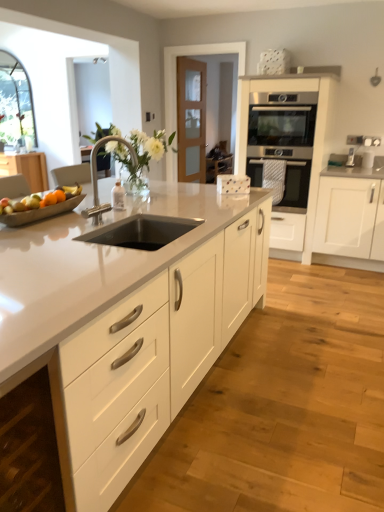
Question: From the image's perspective, is white matte cabinet at lower left, the first cabinetry positioned from the left, over satin white oven at center, which is the 3th cabinetry in front-to-back order?

Choices:
 (A) yes
 (B) no

Answer: (B)

Question: Is white matte cabinet at lower left, which is the 3th cabinetry in right-to-left order, behind satin white oven at center, which is the 3th cabinetry in front-to-back order?

Choices:
 (A) no
 (B) yes

Answer: (A)

Question: From a real-world perspective, is white matte cabinet at lower left, which is the 3th cabinetry in right-to-left order, beneath satin white oven at center, marked as the 2th cabinetry in a right-to-left arrangement?

Choices:
 (A) yes
 (B) no

Answer: (A)

Question: Is white matte cabinet at lower left, the first cabinetry positioned from the left, thinner than satin white oven at center, positioned as the 2th cabinetry in left-to-right order?

Choices:
 (A) no
 (B) yes

Answer: (B)

Question: Are white matte cabinet at lower left, the first cabinetry positioned from the left, and satin white oven at center, which is the 3th cabinetry in front-to-back order, located far from each other?

Choices:
 (A) yes
 (B) no

Answer: (A)

Question: From the image's perspective, is white matte cabinet at lower left, which is the 3th cabinetry in right-to-left order, located above or below stainless steel oven at center?

Choices:
 (A) above
 (B) below

Answer: (B)

Question: Considering the positions of white matte cabinet at lower left, placed as the 1th cabinetry when sorted from front to back, and stainless steel oven at center in the image, is white matte cabinet at lower left, placed as the 1th cabinetry when sorted from front to back, taller or shorter than stainless steel oven at center?

Choices:
 (A) short
 (B) tall

Answer: (B)

Question: In terms of width, does white matte cabinet at lower left, placed as the 1th cabinetry when sorted from front to back, look wider or thinner when compared to stainless steel oven at center?

Choices:
 (A) wide
 (B) thin

Answer: (B)

Question: Is white matte cabinet at lower left, the first cabinetry positioned from the left, inside or outside of stainless steel oven at center?

Choices:
 (A) inside
 (B) outside

Answer: (B)

Question: In terms of height, does white matte cabinet at lower left, the first cabinetry positioned from the left, look taller or shorter compared to shiny metallic bowl at left?

Choices:
 (A) short
 (B) tall

Answer: (B)

Question: From a real-world perspective, is white matte cabinet at lower left, the first cabinetry positioned from the left, above or below shiny metallic bowl at left?

Choices:
 (A) below
 (B) above

Answer: (A)

Question: In the image, is white matte cabinet at lower left, which is the 3th cabinetry in right-to-left order, positioned in front of or behind shiny metallic bowl at left?

Choices:
 (A) front
 (B) behind

Answer: (A)

Question: Considering the positions of white matte cabinet at lower left, which is the 3th cabinetry in right-to-left order, and shiny metallic bowl at left in the image, is white matte cabinet at lower left, which is the 3th cabinetry in right-to-left order, wider or thinner than shiny metallic bowl at left?

Choices:
 (A) thin
 (B) wide

Answer: (B)

Question: From a real-world perspective, relative to white matte cabinet at lower left, the third cabinetry when ordered from back to front, is black stainless steel sink at center vertically above or below?

Choices:
 (A) below
 (B) above

Answer: (B)

Question: In the image, is black stainless steel sink at center positioned in front of or behind white matte cabinet at lower left, which is the 3th cabinetry in right-to-left order?

Choices:
 (A) front
 (B) behind

Answer: (B)